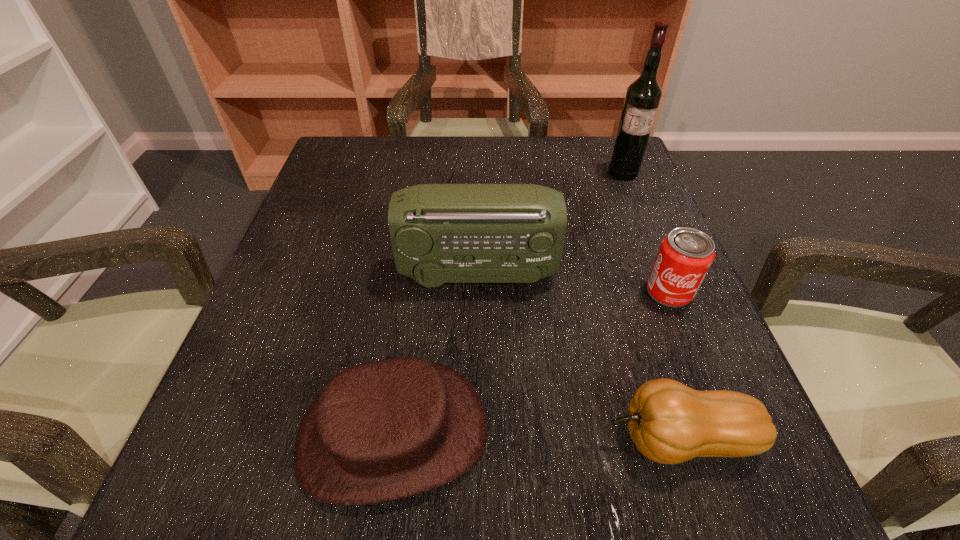
The width and height of the screenshot is (960, 540). In order to click on free space that satisfies the following two spatial constraints: 1. on the front and back of the wine bottle; 2. on the stem side of the gourd in this screenshot , I will do (731, 439).

Where is `vacant area in the image that satisfies the following two spatial constraints: 1. on the back side of the can; 2. on the front-facing side of the second tallest object`? This screenshot has width=960, height=540. vacant area in the image that satisfies the following two spatial constraints: 1. on the back side of the can; 2. on the front-facing side of the second tallest object is located at coordinates (661, 272).